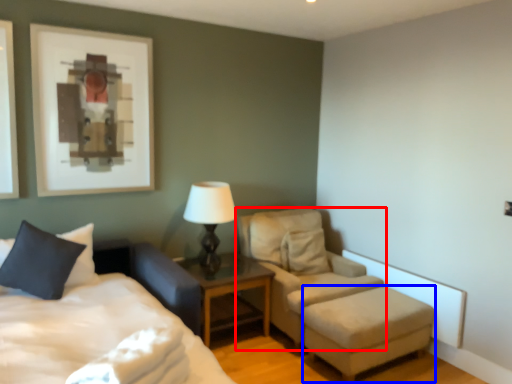
Question: Among these objects, which one is nearest to the camera, chair (highlighted by a red box) or stool (highlighted by a blue box)?

Choices:
 (A) chair
 (B) stool

Answer: (B)